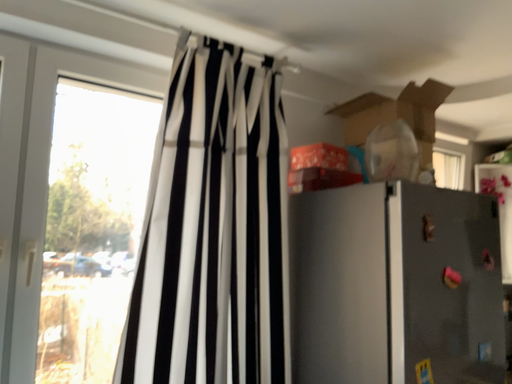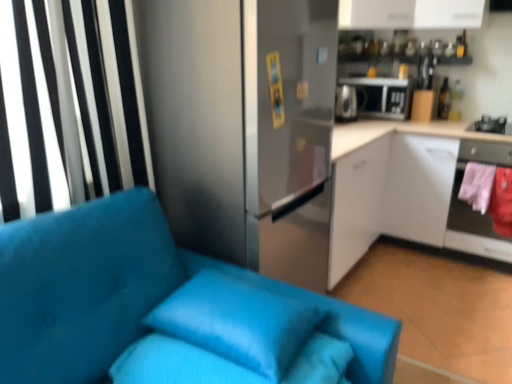
Question: How did the camera likely rotate when shooting the video?

Choices:
 (A) rotated upward
 (B) rotated downward

Answer: (B)